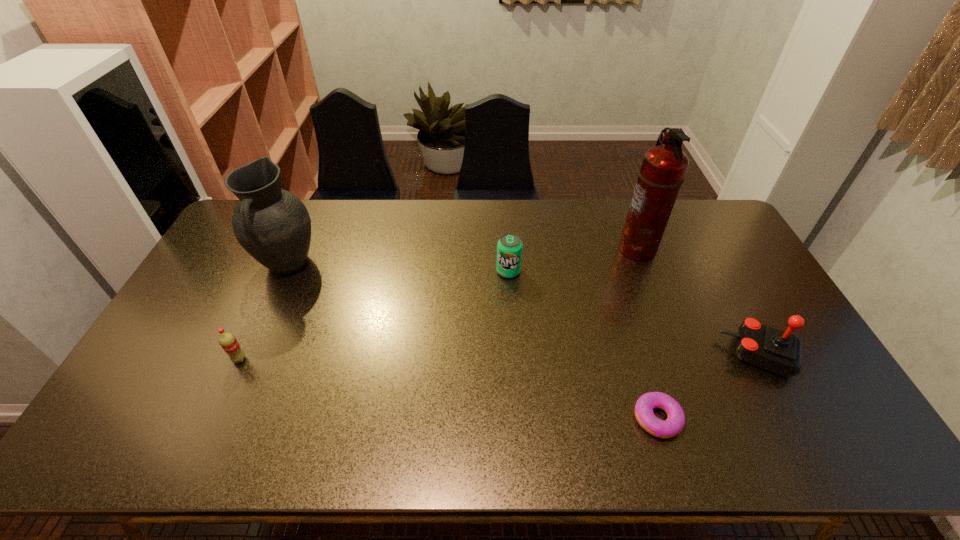
Where is `free location that satisfies the following two spatial constraints: 1. on the nozzle side of the tallest object; 2. on the front side of the shortest object`? This screenshot has height=540, width=960. free location that satisfies the following two spatial constraints: 1. on the nozzle side of the tallest object; 2. on the front side of the shortest object is located at coordinates (702, 418).

At what (x,y) coordinates should I click in order to perform the action: click on vacant region that satisfies the following two spatial constraints: 1. on the front-facing side of the third tallest object; 2. on the left side of the farther soda. Please return your answer as a coordinate pair (x, y). The image size is (960, 540). Looking at the image, I should click on (514, 355).

The height and width of the screenshot is (540, 960). Identify the location of free space that satisfies the following two spatial constraints: 1. on the front-facing side of the fourth object from right to left; 2. on the left side of the doughnut. (517, 418).

Where is `vacant space that satisfies the following two spatial constraints: 1. on the side of the fifth shortest object with the handle; 2. on the right side of the shortest object`? The image size is (960, 540). vacant space that satisfies the following two spatial constraints: 1. on the side of the fifth shortest object with the handle; 2. on the right side of the shortest object is located at coordinates (219, 418).

Find the location of a particular element. The width and height of the screenshot is (960, 540). vacant point that satisfies the following two spatial constraints: 1. on the nozzle side of the tallest object; 2. on the side of the fifth shortest object with the handle is located at coordinates (643, 265).